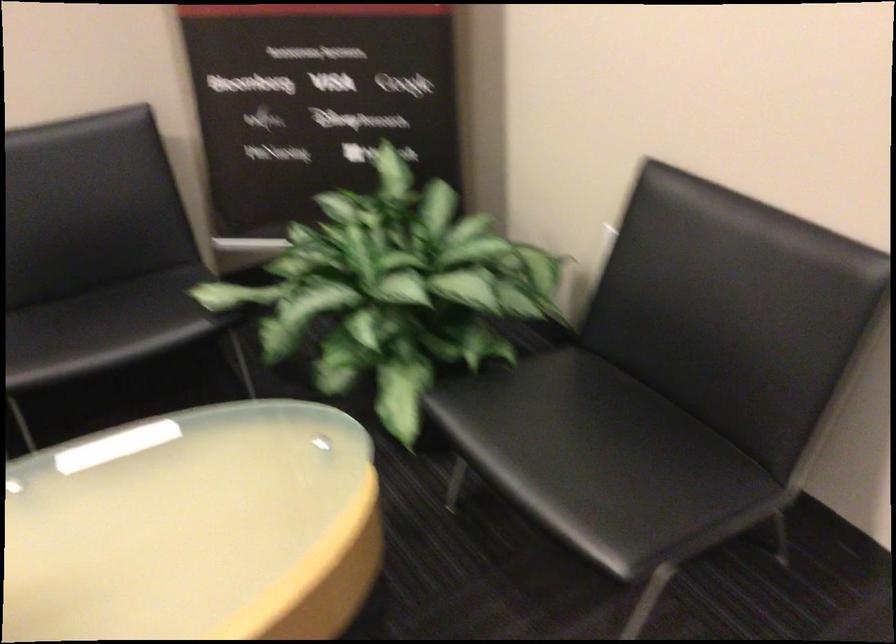
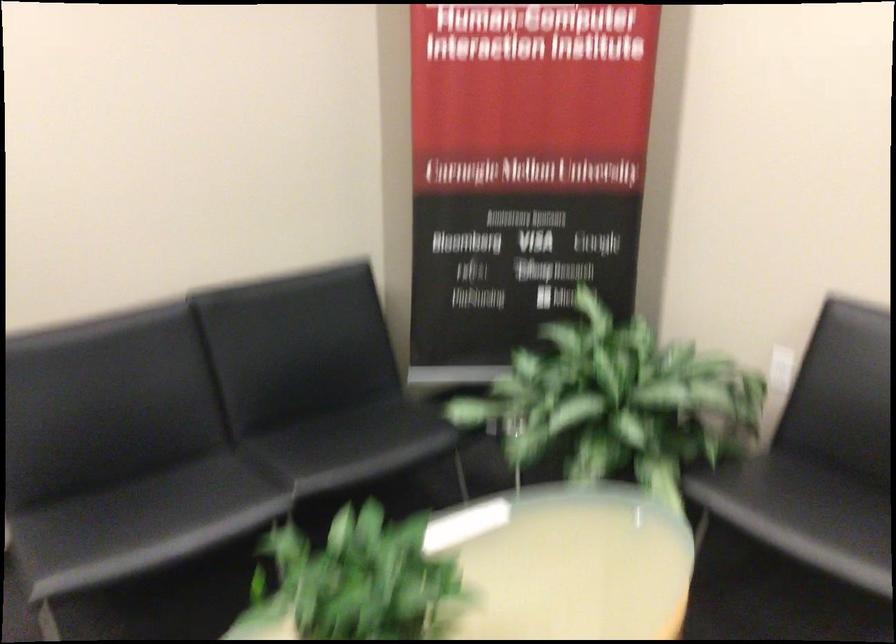
Question: What movement of the cameraman would produce the second image?

Choices:
 (A) Left
 (B) Right
 (C) Forward
 (D) Backward

Answer: (A)